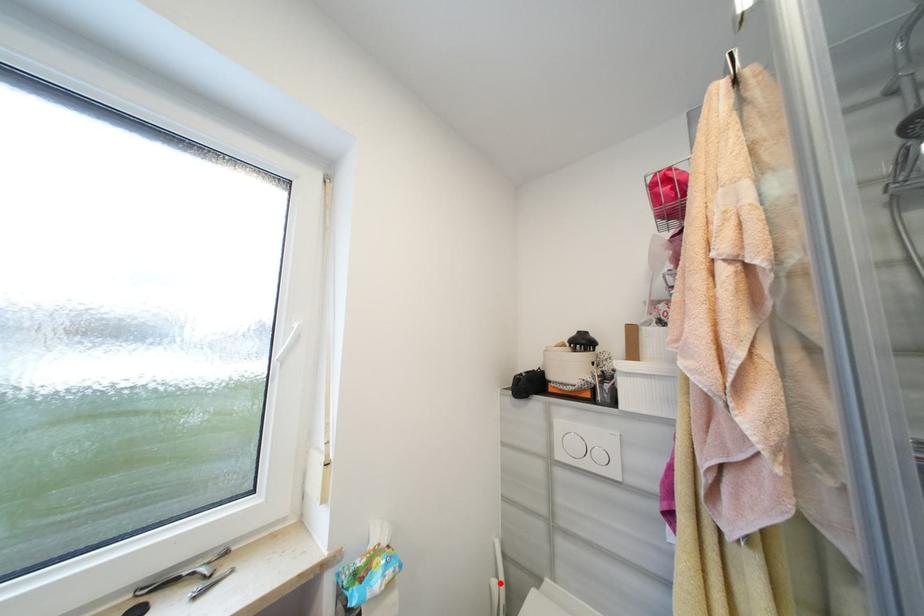
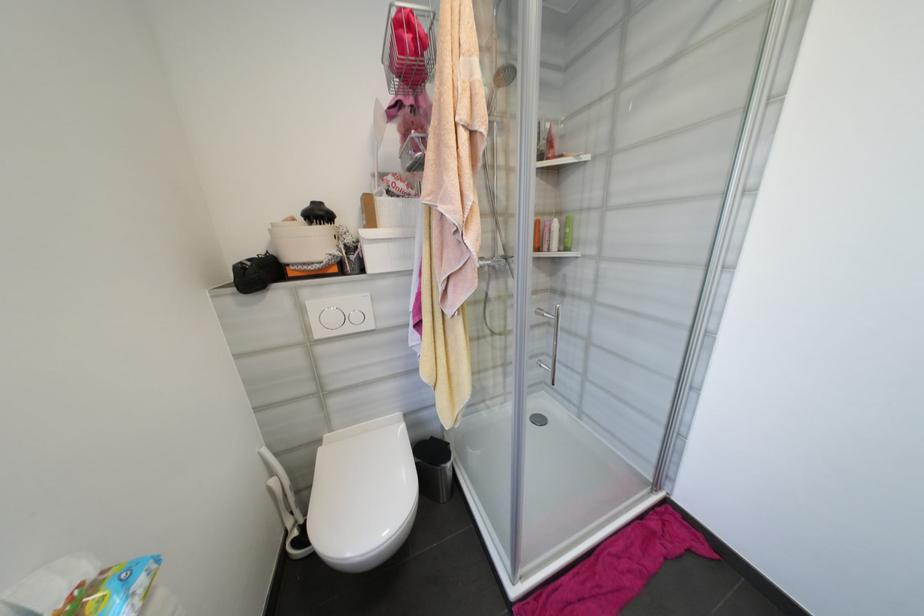
Question: I am providing you with two images of the same scene from different viewpoints. A red point is marked on the first image. Can you still see the location of the red point in image 2?

Choices:
 (A) Yes
 (B) No

Answer: (A)